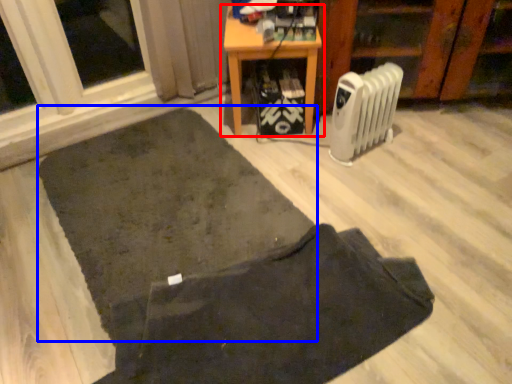
Question: Which object appears closest to the camera in this image, table (highlighted by a red box) or mat (highlighted by a blue box)?

Choices:
 (A) table
 (B) mat

Answer: (B)